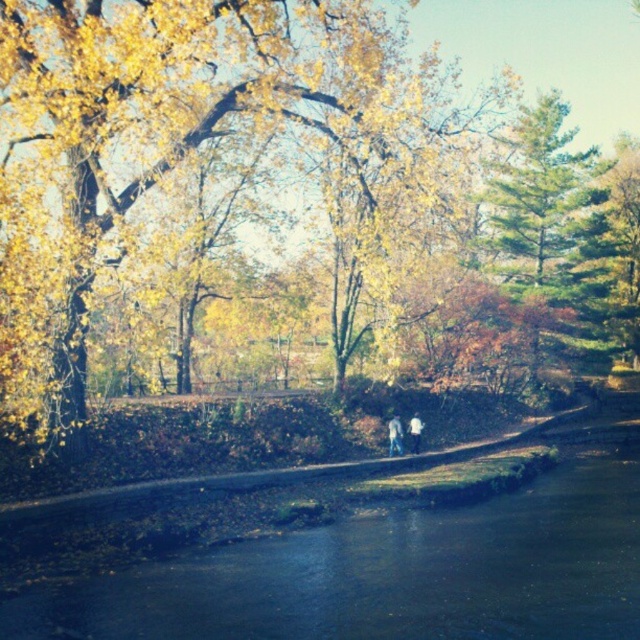
You are standing at the center of the pathway in the autumn scene. Looking around, you notice a point marked at coordinates (x=394, y=435). What object is located at this point?

The point at coordinates (x=394, y=435) marks the location of light blue jeans at center.

You are standing at the edge of the dark blue water at center and see the light blue jeans at center. Which object is taller?

The light blue jeans at center are taller than the dark blue water at center.